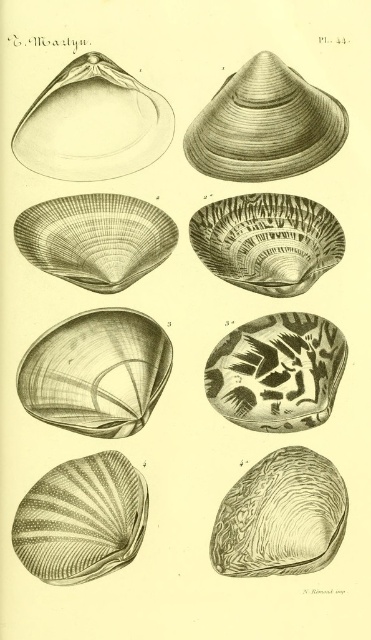
Question: Does smooth brown shell at center have a smaller size compared to matte black shell at upper left?

Choices:
 (A) no
 (B) yes

Answer: (A)

Question: Among these points, which one is nearest to the camera?

Choices:
 (A) pos(224,259)
 (B) pos(303,365)
 (C) pos(23,515)
 (D) pos(197,154)

Answer: (C)

Question: Which of the following is the closest to the observer?

Choices:
 (A) smooth brown shell at bottom right
 (B) smooth brown shell at center
 (C) speckled stone shell at center

Answer: (A)

Question: Considering the real-world distances, which object is farthest from the smooth brown shell at upper center?

Choices:
 (A) matte brown shell at center
 (B) greenish-brown textured shell at bottom left
 (C) smooth brown shell at bottom right
 (D) speckled stone shell at center

Answer: (B)

Question: Does smooth brown shell at center have a smaller size compared to smooth brown shell at upper center?

Choices:
 (A) yes
 (B) no

Answer: (A)

Question: Does textured brown shell at center appear over matte brown shell at center?

Choices:
 (A) no
 (B) yes

Answer: (B)